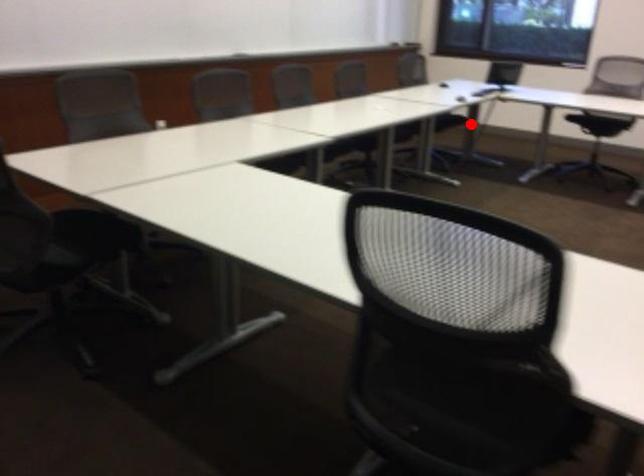
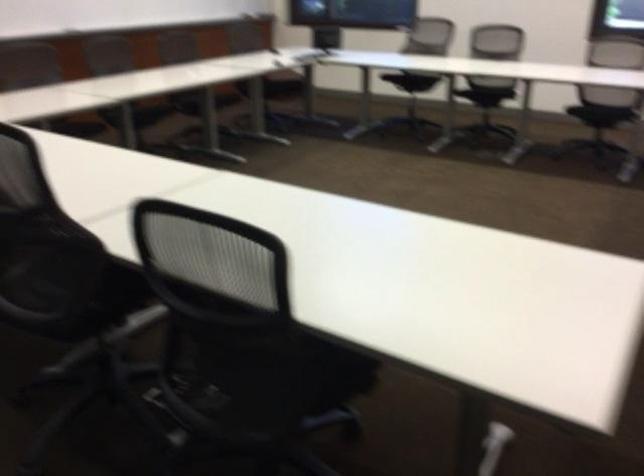
Question: I am providing you with two images of the same scene from different viewpoints. A red point is marked on the first image. Is the red point's position out of view in image 2?

Choices:
 (A) Yes
 (B) No

Answer: (B)